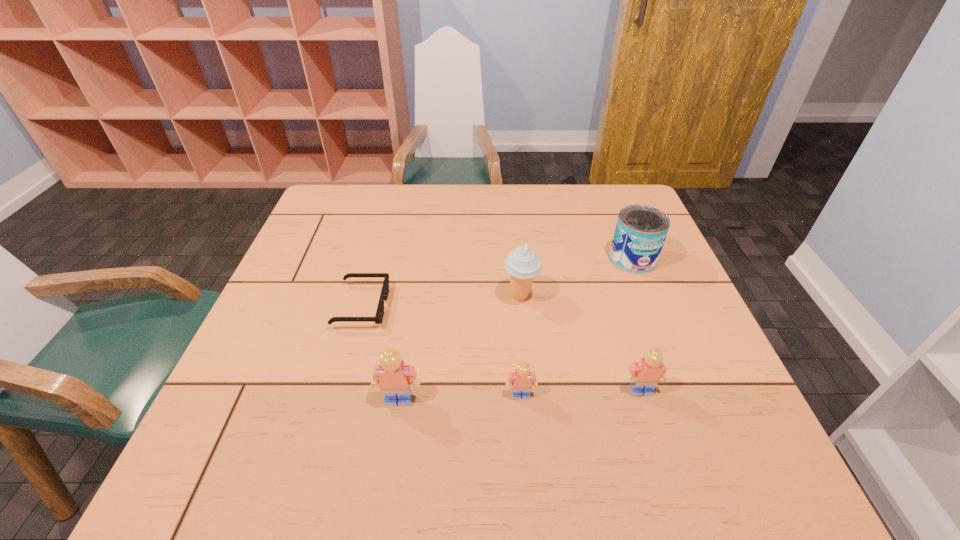
The image size is (960, 540). Identify the location of vacant space at the far left corner of the desktop. (348, 225).

Locate an element on the screen. The height and width of the screenshot is (540, 960). vacant point at the near right corner is located at coordinates (674, 408).

Identify the location of blank region between the second Lego from right to left and the shortest object. This screenshot has height=540, width=960. click(x=442, y=350).

I want to click on free point between the leftmost Lego and the icecream, so click(460, 347).

Find the location of a particular element. The height and width of the screenshot is (540, 960). free space between the leftmost object and the second shortest Lego is located at coordinates (501, 348).

The height and width of the screenshot is (540, 960). Find the location of `vacant space that is in between the icecream and the sunglasses`. vacant space that is in between the icecream and the sunglasses is located at coordinates (442, 301).

Locate an element on the screen. vacant area between the icecream and the sunglasses is located at coordinates (442, 301).

This screenshot has height=540, width=960. What are the coordinates of `vacant region between the farthest object and the icecream` in the screenshot? It's located at (577, 277).

The height and width of the screenshot is (540, 960). In order to click on empty space between the second Lego from right to left and the second shortest Lego in this screenshot , I will do `click(581, 393)`.

Identify the location of empty space that is in between the farthest object and the second tallest Lego. (636, 325).